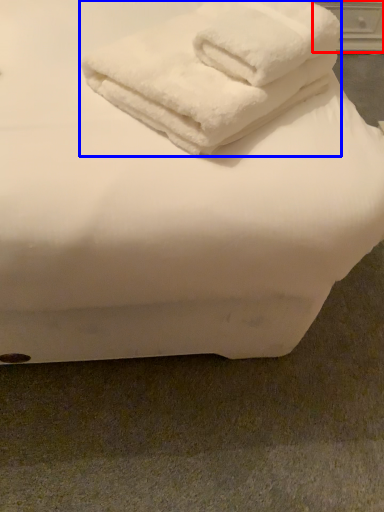
Question: Which point is closer to the camera, drawer (highlighted by a red box) or towel (highlighted by a blue box)?

Choices:
 (A) drawer
 (B) towel

Answer: (B)